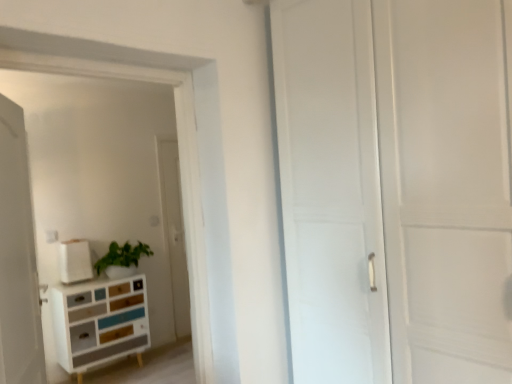
Question: From a real-world perspective, is white matte box at upper left under multicolored wood chest of drawers at lower left?

Choices:
 (A) yes
 (B) no

Answer: (B)

Question: Can you confirm if white matte box at upper left is smaller than multicolored wood chest of drawers at lower left?

Choices:
 (A) yes
 (B) no

Answer: (A)

Question: Is white matte box at upper left looking in the opposite direction of multicolored wood chest of drawers at lower left?

Choices:
 (A) yes
 (B) no

Answer: (B)

Question: From a real-world perspective, is white matte box at upper left over multicolored wood chest of drawers at lower left?

Choices:
 (A) yes
 (B) no

Answer: (A)

Question: Considering the relative sizes of white matte box at upper left and multicolored wood chest of drawers at lower left in the image provided, is white matte box at upper left wider than multicolored wood chest of drawers at lower left?

Choices:
 (A) no
 (B) yes

Answer: (A)

Question: In the image, is white matte box at upper left positioned in front of or behind white matte door at left?

Choices:
 (A) front
 (B) behind

Answer: (B)

Question: Would you say white matte box at upper left is to the left or to the right of white matte door at left in the picture?

Choices:
 (A) right
 (B) left

Answer: (B)

Question: Based on their sizes in the image, would you say white matte box at upper left is bigger or smaller than white matte door at left?

Choices:
 (A) small
 (B) big

Answer: (A)

Question: From the image's perspective, is white matte box at upper left positioned above or below white matte door at left?

Choices:
 (A) above
 (B) below

Answer: (B)

Question: Considering the positions of white matte door at left and multicolored wood chest of drawers at lower left in the image, is white matte door at left taller or shorter than multicolored wood chest of drawers at lower left?

Choices:
 (A) tall
 (B) short

Answer: (A)

Question: Would you say white matte door at left is to the left or to the right of multicolored wood chest of drawers at lower left in the picture?

Choices:
 (A) left
 (B) right

Answer: (B)

Question: Choose the correct answer: Is white matte door at left inside multicolored wood chest of drawers at lower left or outside it?

Choices:
 (A) outside
 (B) inside

Answer: (A)

Question: Relative to multicolored wood chest of drawers at lower left, is white matte door at left in front or behind?

Choices:
 (A) behind
 (B) front

Answer: (B)

Question: From their relative heights in the image, would you say multicolored wood chest of drawers at lower left is taller or shorter than white matte box at upper left?

Choices:
 (A) tall
 (B) short

Answer: (A)

Question: Does point (65, 334) appear closer or farther from the camera than point (74, 253)?

Choices:
 (A) closer
 (B) farther

Answer: (A)